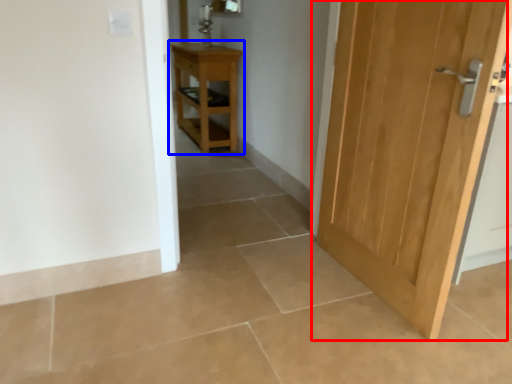
Question: Which object appears farthest to the camera in this image, door (highlighted by a red box) or nightstand (highlighted by a blue box)?

Choices:
 (A) door
 (B) nightstand

Answer: (B)